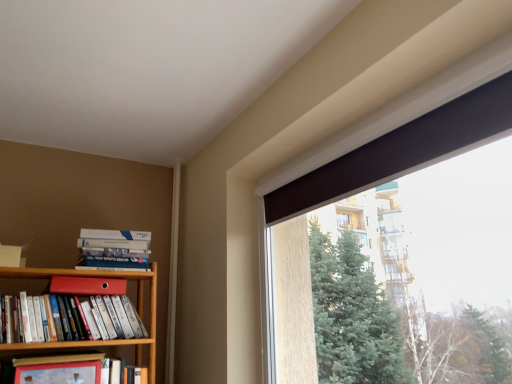
Question: Can you confirm if hardcover book at left, which is counted as the third book, starting from the top, is smaller than hardcover books at left, the 3th book positioned from the bottom?

Choices:
 (A) no
 (B) yes

Answer: (B)

Question: Does hardcover book at left, which is the 1th book in bottom-to-top order, have a larger size compared to hardcover books at left, the 3th book positioned from the bottom?

Choices:
 (A) no
 (B) yes

Answer: (A)

Question: From the image's perspective, does hardcover book at left, which is the 1th book in bottom-to-top order, appear lower than hardcover books at left, marked as the 1th book in a top-to-bottom arrangement?

Choices:
 (A) yes
 (B) no

Answer: (A)

Question: Is hardcover book at left, which is counted as the third book, starting from the top, outside of hardcover books at left, marked as the 1th book in a top-to-bottom arrangement?

Choices:
 (A) no
 (B) yes

Answer: (B)

Question: Is hardcover book at left, which is the 1th book in bottom-to-top order, looking in the opposite direction of hardcover books at left, the 3th book positioned from the bottom?

Choices:
 (A) no
 (B) yes

Answer: (A)

Question: Looking at their shapes, would you say hardcover book at left, which is the 1th book in bottom-to-top order, is wider or thinner than matte red folder at upper left, which is counted as the 1th paperback book, starting from the back?

Choices:
 (A) thin
 (B) wide

Answer: (A)

Question: Relative to matte red folder at upper left, which is the second paperback book from bottom to top, is hardcover book at left, which is the 1th book in bottom-to-top order, in front or behind?

Choices:
 (A) behind
 (B) front

Answer: (B)

Question: From the image's perspective, relative to matte red folder at upper left, which is the second paperback book from bottom to top, is hardcover book at left, which is the 1th book in bottom-to-top order, above or below?

Choices:
 (A) below
 (B) above

Answer: (A)

Question: In terms of size, does hardcover book at left, which is the 1th book in bottom-to-top order, appear bigger or smaller than matte red folder at upper left, which is counted as the 1th paperback book, starting from the back?

Choices:
 (A) small
 (B) big

Answer: (A)

Question: From the image's perspective, is hardcover book at left, arranged as the 2th paperback book when viewed from the back, above or below hardcover books at left, marked as the 1th book in a top-to-bottom arrangement?

Choices:
 (A) below
 (B) above

Answer: (A)

Question: Is hardcover book at left, arranged as the 2th paperback book when viewed from the back, in front of or behind hardcover books at left, marked as the 1th book in a top-to-bottom arrangement, in the image?

Choices:
 (A) front
 (B) behind

Answer: (A)

Question: Visually, is hardcover book at left, which is the second paperback book from top to bottom, positioned to the left or to the right of hardcover books at left, the 3th book positioned from the bottom?

Choices:
 (A) right
 (B) left

Answer: (B)

Question: Considering the positions of hardcover book at left, the 1th paperback book positioned from the front, and hardcover books at left, marked as the 1th book in a top-to-bottom arrangement, in the image, is hardcover book at left, the 1th paperback book positioned from the front, bigger or smaller than hardcover books at left, marked as the 1th book in a top-to-bottom arrangement,?

Choices:
 (A) big
 (B) small

Answer: (B)

Question: In terms of width, does hardcover book at left, which is the second paperback book from top to bottom, look wider or thinner when compared to matte red bookshelf at left, which ranks as the second book in bottom-to-top order?

Choices:
 (A) wide
 (B) thin

Answer: (B)

Question: Considering the positions of point (41, 364) and point (10, 337), is point (41, 364) closer or farther from the camera than point (10, 337)?

Choices:
 (A) closer
 (B) farther

Answer: (A)